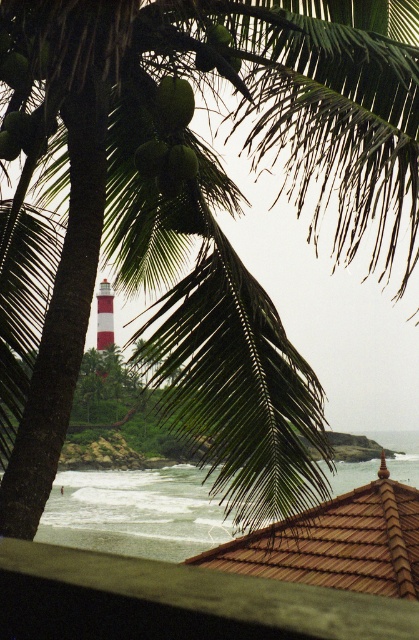
You are standing at the base of the palm tree on the left side of the image. Looking towards the center, can you see the brown tile roof at lower center represented by point (336, 541)?

The brown tile roof at lower center represented by point (336, 541) is located at lower center, so yes, you can see it from the base of the palm tree on the left side of the image as it is in the lower central area of the view.

You are standing in front of the palm tree and want to pick both the green matte coconut at upper center and the green matte coconut at center. Which coconut should you reach for first to pick the one closer to you?

The green matte coconut at upper center is closer to the viewer, so you should reach for it first.

You are a bird flying over the coastal scene. You want to land on the highest point between the brown tile roof at lower center and the white striped tower at center. Which one should you choose?

The white striped tower at center is taller than the brown tile roof at lower center, so you should choose the white striped tower at center to land on the highest point.